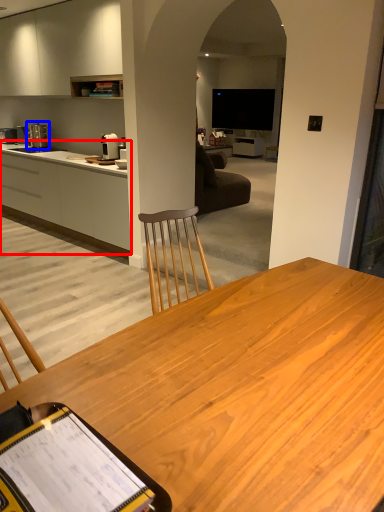
Question: Among these objects, which one is farthest to the camera, cabinetry (highlighted by a red box) or coffee machine (highlighted by a blue box)?

Choices:
 (A) cabinetry
 (B) coffee machine

Answer: (B)